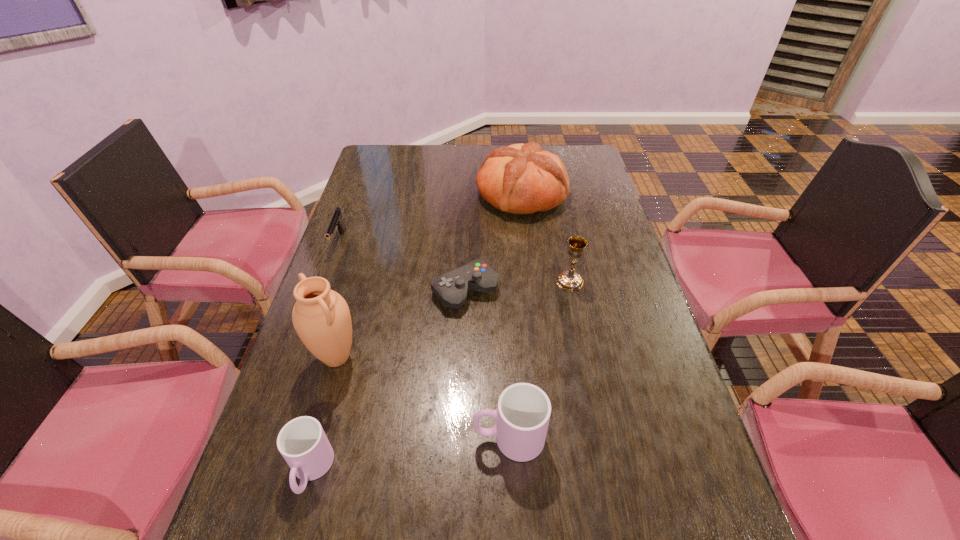
You are a GUI agent. You are given a task and a screenshot of the screen. Output one action in this format:
    pyautogui.click(x=<x>, y=<y>)
    Task: Click on the vacant space positioned with the handle on the side of the taller cup
    The height and width of the screenshot is (540, 960).
    Given the screenshot: What is the action you would take?
    (x=324, y=438)

Find the location of a particular element. free spot located with the handle on the side of the taller cup is located at coordinates (435, 438).

Find the location of a particular element. The image size is (960, 540). vacant space situated 0.050m with the handle on the side of the taller cup is located at coordinates pyautogui.click(x=449, y=438).

Locate an element on the screen. The height and width of the screenshot is (540, 960). vacant space located 0.250m on the front of the farthest object is located at coordinates (531, 273).

You are a GUI agent. You are given a task and a screenshot of the screen. Output one action in this format:
    pyautogui.click(x=<x>, y=<y>)
    Task: Click on the vacant space located at the muzzle of the pistol
    The height and width of the screenshot is (540, 960).
    Given the screenshot: What is the action you would take?
    pyautogui.click(x=313, y=314)

The width and height of the screenshot is (960, 540). Find the location of `free region located 0.080m on the front of the chalice`. free region located 0.080m on the front of the chalice is located at coordinates (576, 313).

Where is `free point located 0.370m on the right of the fifth farthest object`? free point located 0.370m on the right of the fifth farthest object is located at coordinates (514, 357).

The height and width of the screenshot is (540, 960). What are the coordinates of `free spot located on the right of the shortest object` in the screenshot? It's located at (563, 291).

Image resolution: width=960 pixels, height=540 pixels. Find the location of `object present at the far edge`. object present at the far edge is located at coordinates (523, 179).

I want to click on object at the near edge, so tap(302, 442).